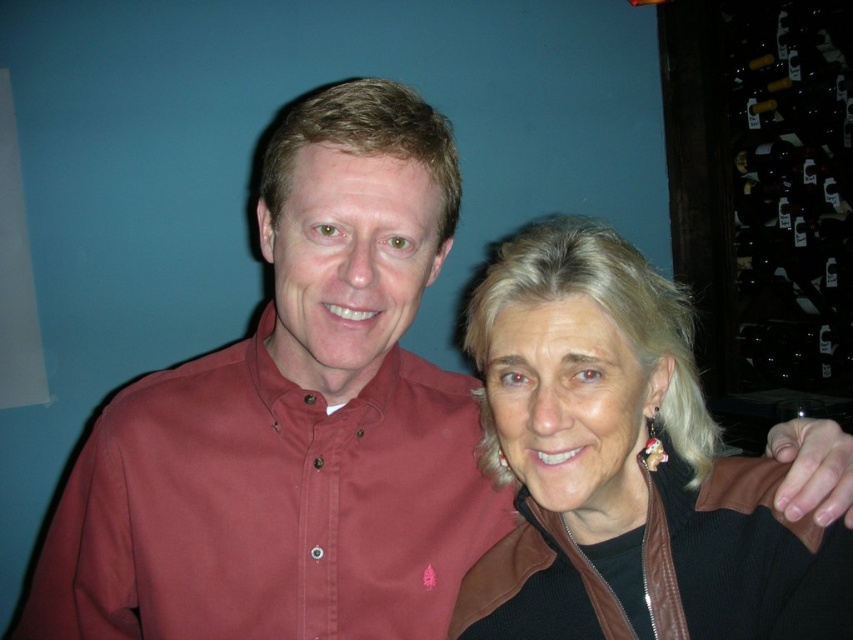
Is point (283, 531) more distant than point (749, 582)?

Yes.

What do you see at coordinates (268, 508) in the screenshot? I see `burgundy cotton shirt at center` at bounding box center [268, 508].

Find the location of a particular element. burgundy cotton shirt at center is located at coordinates (268, 508).